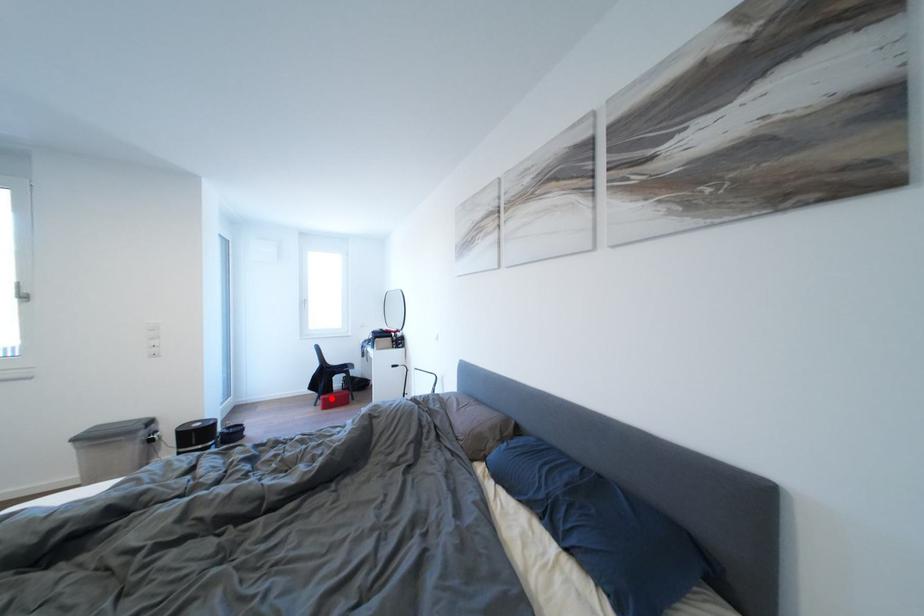
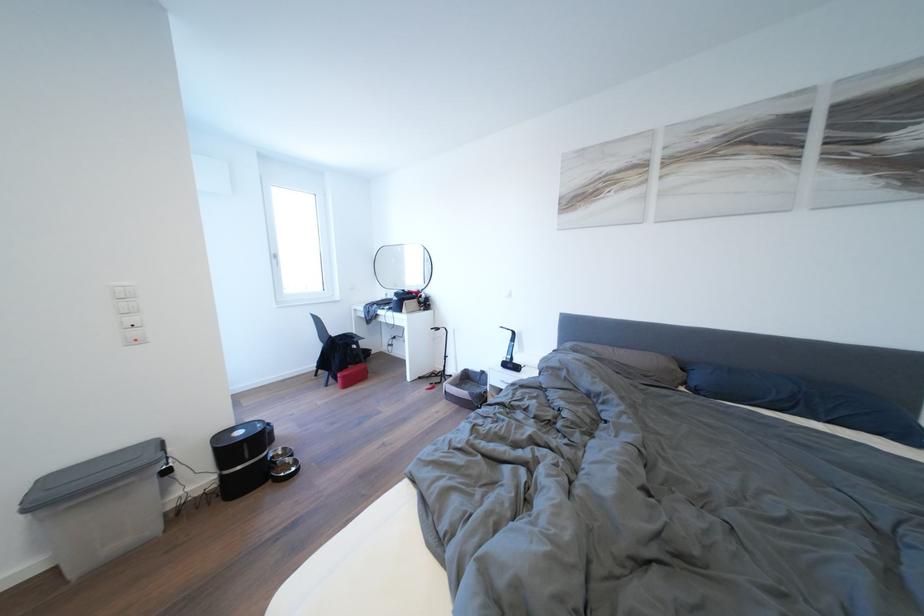
Locate, in the second image, the point that corresponds to the highlighted location in the first image.

(348, 376)